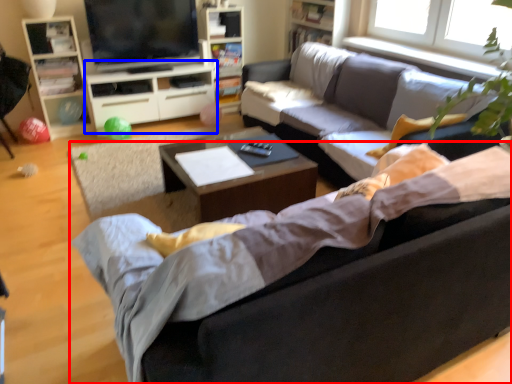
Question: Which of the following is the farthest to the observer, studio couch (highlighted by a red box) or entertainment center (highlighted by a blue box)?

Choices:
 (A) studio couch
 (B) entertainment center

Answer: (B)